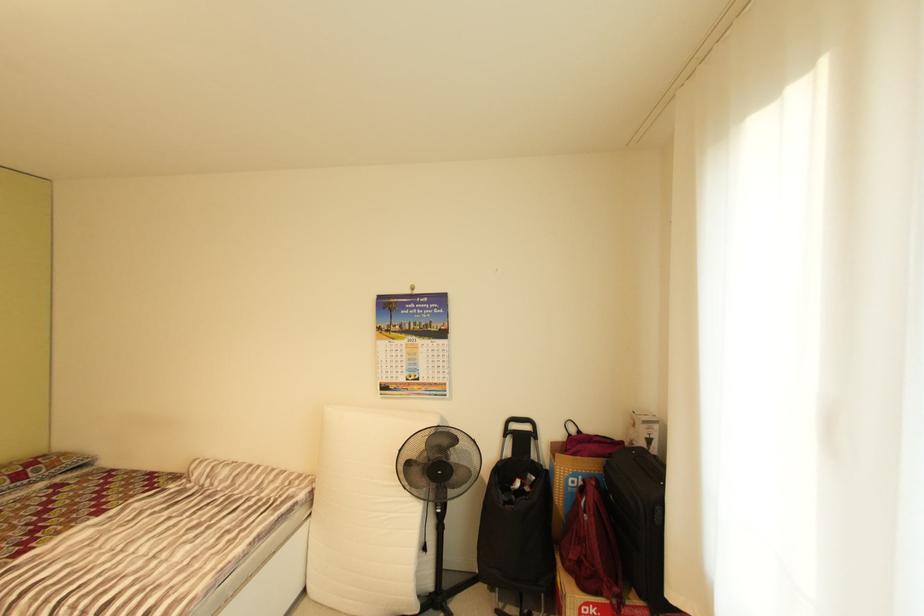
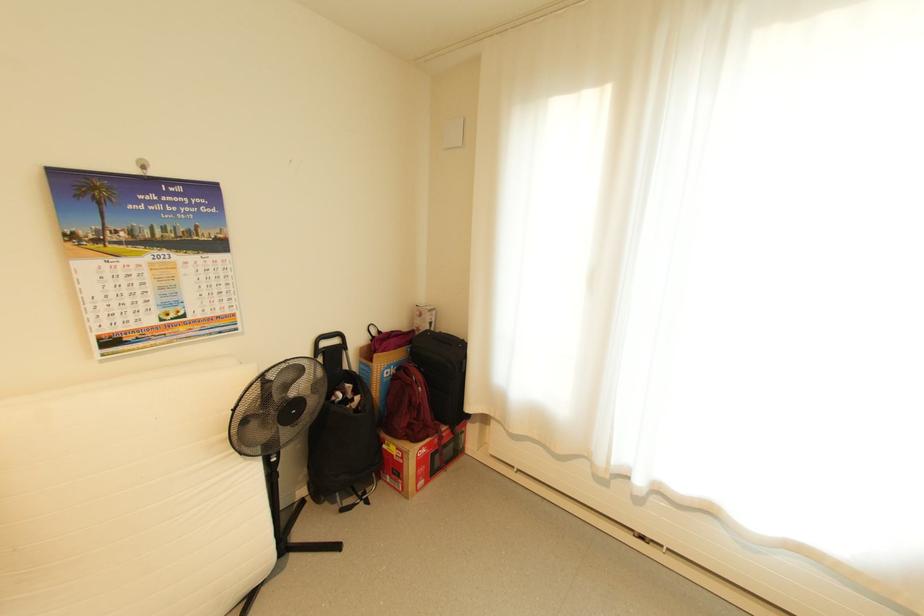
The point at (415, 293) is marked in the first image. Where is the corresponding point in the second image?

(140, 172)